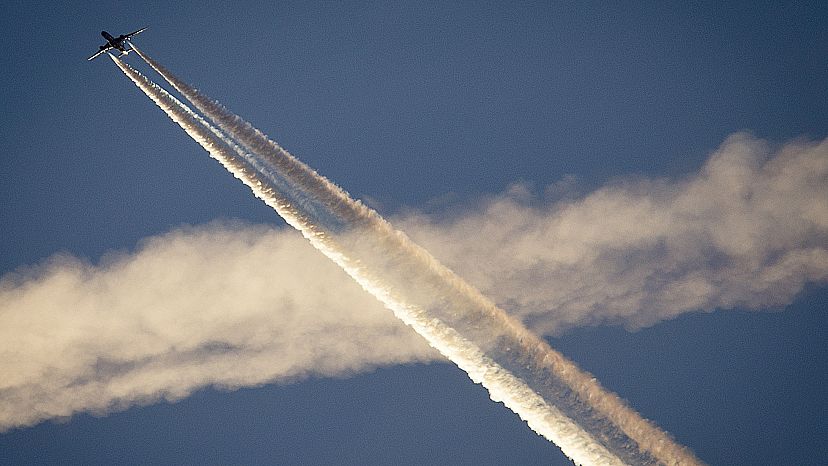
The image size is (828, 466). I want to click on light, so click(x=586, y=444).